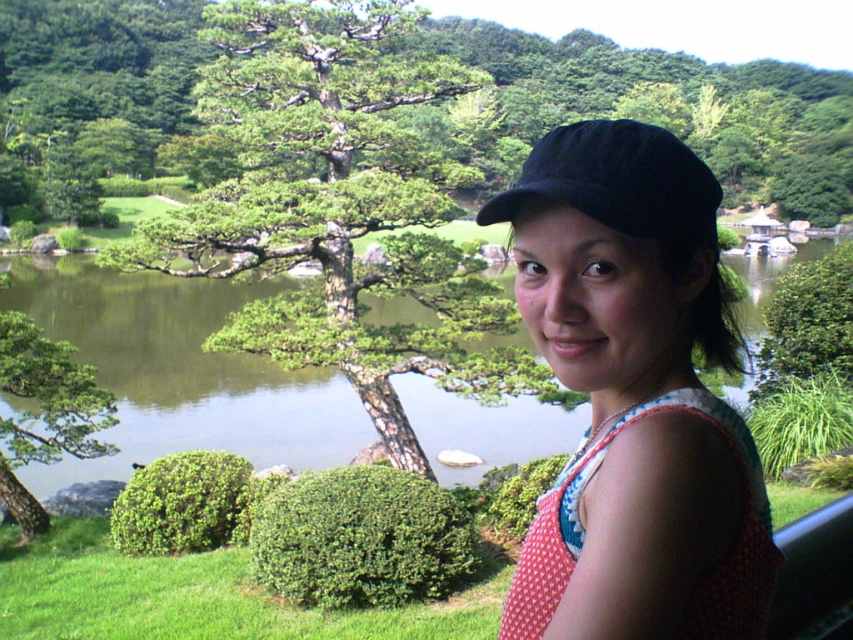
Question: Among these points, which one is farthest from the camera?

Choices:
 (A) (647, 131)
 (B) (575, 465)
 (C) (67, 364)
 (D) (114, 387)

Answer: (D)

Question: Is green leafy tree at center above green liquid water at center?

Choices:
 (A) no
 (B) yes

Answer: (B)

Question: Can you confirm if green liquid water at center is positioned below green textured tree at left?

Choices:
 (A) no
 (B) yes

Answer: (A)

Question: Does green textured tree at center lie in front of green leafy tree at center?

Choices:
 (A) yes
 (B) no

Answer: (A)

Question: Which point is farther to the camera?

Choices:
 (A) black fabric baseball cap at upper center
 (B) green leafy tree at center

Answer: (B)

Question: Which object is closer to the camera taking this photo?

Choices:
 (A) polka dot fabric apron at right
 (B) black fabric baseball cap at upper center
 (C) green textured tree at center

Answer: (A)